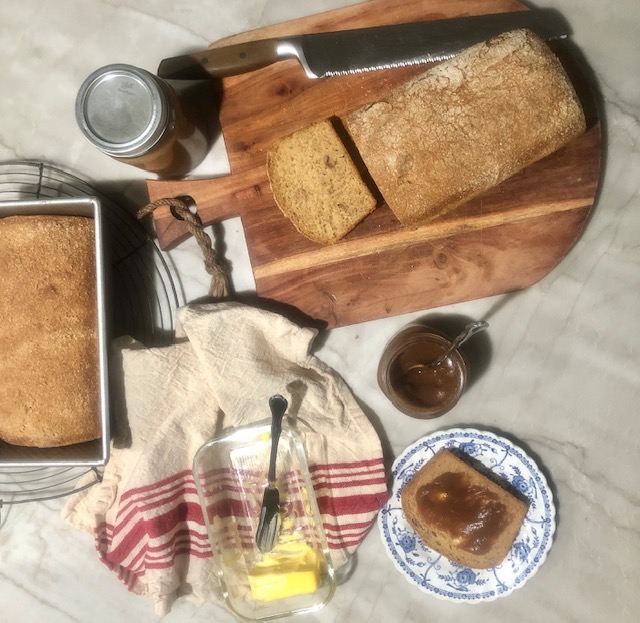
You are a GUI agent. You are given a task and a screenshot of the screen. Output one action in this format:
    pyautogui.click(x=<x>, y=<y>)
    Task: Click on the marble counter
    The width and height of the screenshot is (640, 623).
    Given the screenshot: What is the action you would take?
    pyautogui.click(x=582, y=331)